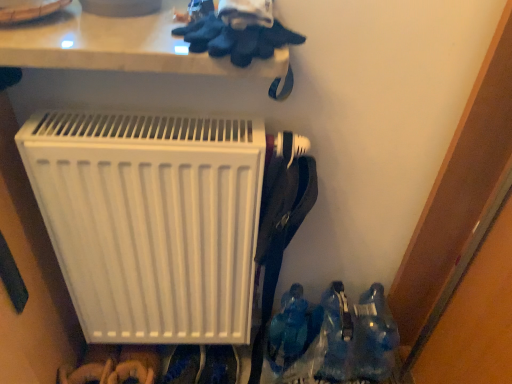
Question: Should I look upward or downward to see white plastic radiator at center?

Choices:
 (A) down
 (B) up

Answer: (A)

Question: Is translucent plastic bottles at lower right taller than white plastic radiator at center?

Choices:
 (A) no
 (B) yes

Answer: (A)

Question: Is the surface of translucent plastic bottles at lower right in direct contact with white plastic radiator at center?

Choices:
 (A) no
 (B) yes

Answer: (A)

Question: Can you confirm if translucent plastic bottles at lower right is smaller than white plastic radiator at center?

Choices:
 (A) yes
 (B) no

Answer: (B)

Question: Is translucent plastic bottles at lower right closer to camera compared to white plastic radiator at center?

Choices:
 (A) no
 (B) yes

Answer: (A)

Question: Is translucent plastic bottles at lower right positioned with its back to white plastic radiator at center?

Choices:
 (A) yes
 (B) no

Answer: (B)

Question: Can you confirm if translucent plastic bottles at lower right is bigger than white plastic radiator at center?

Choices:
 (A) no
 (B) yes

Answer: (B)

Question: From the image's perspective, would you say white plastic radiator at center is positioned over translucent plastic bottles at lower right?

Choices:
 (A) yes
 (B) no

Answer: (A)

Question: Can you confirm if white plastic radiator at center is shorter than translucent plastic bottles at lower right?

Choices:
 (A) no
 (B) yes

Answer: (A)

Question: Is white plastic radiator at center facing away from translucent plastic bottles at lower right?

Choices:
 (A) yes
 (B) no

Answer: (B)

Question: Would you say white plastic radiator at center is a long distance from translucent plastic bottles at lower right?

Choices:
 (A) no
 (B) yes

Answer: (A)

Question: Does white plastic radiator at center have a lesser width compared to translucent plastic bottles at lower right?

Choices:
 (A) no
 (B) yes

Answer: (B)

Question: From the image's perspective, would you say white plastic radiator at center is shown under translucent plastic bottles at lower right?

Choices:
 (A) no
 (B) yes

Answer: (A)

Question: Based on their positions, is translucent plastic bottles at lower right located to the left or right of white plastic radiator at center?

Choices:
 (A) right
 (B) left

Answer: (A)